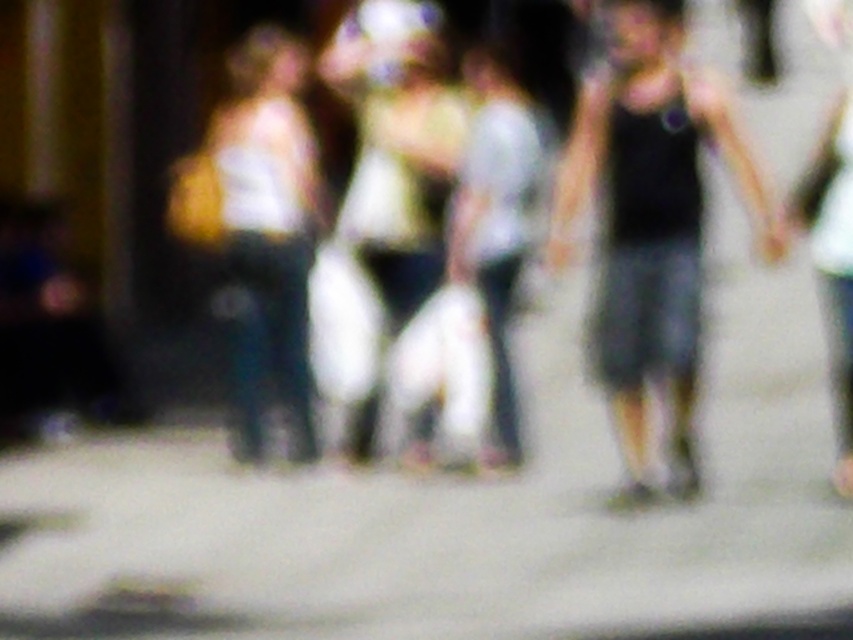
Question: Is white plastic bag at center in front of white cotton shirt at right?

Choices:
 (A) yes
 (B) no

Answer: (B)

Question: Which point is closer to the camera taking this photo?

Choices:
 (A) (788, 205)
 (B) (364, 448)

Answer: (A)

Question: Does black tank top at right have a smaller size compared to matte yellow bag at left?

Choices:
 (A) yes
 (B) no

Answer: (A)

Question: Estimate the real-world distances between objects in this image. Which object is farther from the black tank top at right?

Choices:
 (A) white cotton shirt at right
 (B) matte yellow bag at left
 (C) white plastic bag at center

Answer: (B)

Question: Which point appears closest to the camera in this image?

Choices:
 (A) (242, 200)
 (B) (427, 209)
 (C) (850, 252)

Answer: (C)

Question: Is white plastic bag at center behind white cotton shirt at right?

Choices:
 (A) no
 (B) yes

Answer: (B)